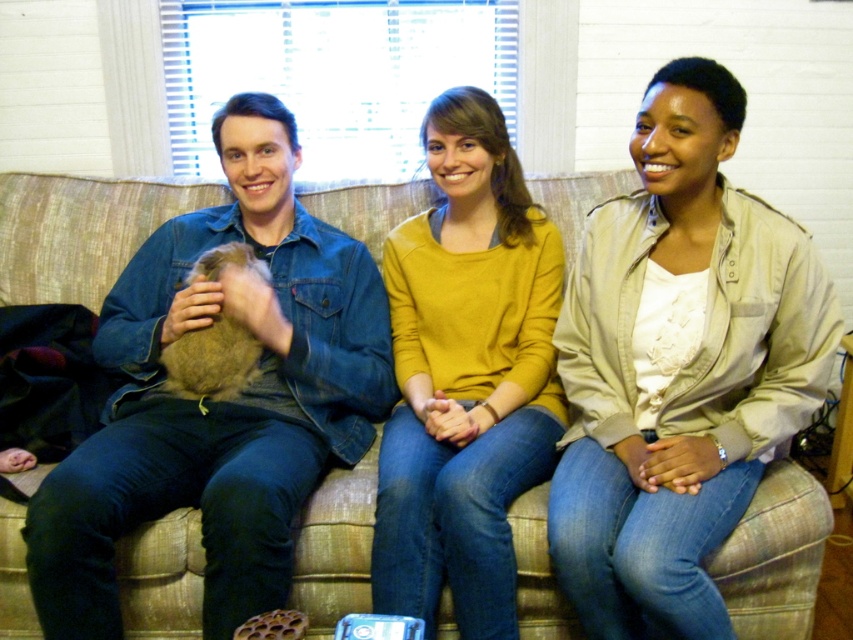
You are standing in front of the couch where three people are sitting. You notice two points marked on the image. One is at coordinate point (660, 416) and the other is at point (88, 269). Which point is closer to you?

Point (660, 416) is closer to the camera than point (88, 269). Since you are standing in front of the couch, the point closer to you would be point (660, 416).

You are a photographer setting up a shoot in this cozy indoor scene. You need to ensure that the beige cotton jacket at center and the beige fabric couch at center are clearly visible in the photo. Given that the jacket is above the couch, where should you position the camera to capture both items without any obstruction?

The beige cotton jacket at center is located above the beige fabric couch at center, so positioning the camera at a lower angle facing upwards would allow both items to be visible without obstruction, as the jacket is positioned higher than the couch.

You are a photographer trying to capture a closeup of the beige cotton jacket at center and the mustard yellow sweater at center. Which one should you focus on first to ensure it appears sharp in the photo?

A: You should focus on the beige cotton jacket at center first because it is closer to the viewer than the mustard yellow sweater at center, so adjusting focus from near to far will help capture both sharply.